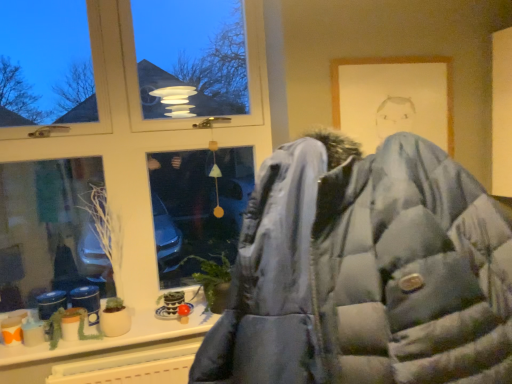
This screenshot has width=512, height=384. Describe the element at coordinates (115, 144) in the screenshot. I see `matte white window at center` at that location.

Describe the element at coordinates (63, 322) in the screenshot. The width and height of the screenshot is (512, 384). I see `green matte plant at lower left, which appears as the 1th plant when ordered from the bottom` at that location.

Locate an element on the screen. green matte plant at lower left, which appears as the 1th plant when ordered from the bottom is located at coordinates (63, 322).

The width and height of the screenshot is (512, 384). I want to click on matte white window at center, so click(115, 144).

Which is more to the right, yellow plastic radiator at lower center or green matte plant at lower left, which appears as the 1th plant when ordered from the bottom?

Positioned to the right is yellow plastic radiator at lower center.

Is yellow plastic radiator at lower center aimed at green matte plant at lower left, which appears as the 1th plant when ordered from the bottom?

No, yellow plastic radiator at lower center is not oriented towards green matte plant at lower left, which appears as the 1th plant when ordered from the bottom.

Looking at their sizes, would you say yellow plastic radiator at lower center is wider or thinner than green matte plant at lower left, which appears as the 1th plant when ordered from the bottom?

In the image, yellow plastic radiator at lower center appears to be more narrow than green matte plant at lower left, which appears as the 1th plant when ordered from the bottom.

Are yellow plastic radiator at lower center and green matte plant at lower left, which is the 2th plant from top to bottom, making contact?

yellow plastic radiator at lower center and green matte plant at lower left, which is the 2th plant from top to bottom, are not in contact.

From a real-world perspective, is yellow plastic radiator at lower center located higher than matte white window at center?

No.

How many degrees apart are the facing directions of yellow plastic radiator at lower center and matte white window at center?

The facing directions of yellow plastic radiator at lower center and matte white window at center are 0.386 degrees apart.

Measure the distance from yellow plastic radiator at lower center to matte white window at center.

yellow plastic radiator at lower center and matte white window at center are 29.05 inches apart.

Consider the image. Considering the relative positions of yellow plastic radiator at lower center and matte white window at center in the image provided, is yellow plastic radiator at lower center to the left of matte white window at center from the viewer's perspective?

No.

The height and width of the screenshot is (384, 512). In order to click on radiator on the right of white matte plant at lower left, the 2th plant ordered from the bottom in this screenshot , I will do `click(134, 373)`.

Can we say yellow plastic radiator at lower center lies outside white matte plant at lower left, the 2th plant ordered from the bottom?

That's correct, yellow plastic radiator at lower center is outside of white matte plant at lower left, the 2th plant ordered from the bottom.

Is point (166, 372) more distant than point (113, 249)?

No, it is in front of (113, 249).

Is yellow plastic radiator at lower center directly adjacent to white matte plant at lower left, the 1th plant positioned from the top?

There is a gap between yellow plastic radiator at lower center and white matte plant at lower left, the 1th plant positioned from the top.

Is matte white window at center thinner than green matte plant at lower left, which is the 2th plant from top to bottom?

Indeed, matte white window at center has a lesser width compared to green matte plant at lower left, which is the 2th plant from top to bottom.

Considering the relative sizes of matte white window at center and green matte plant at lower left, which is the 2th plant from top to bottom, in the image provided, is matte white window at center bigger than green matte plant at lower left, which is the 2th plant from top to bottom,?

Correct, matte white window at center is larger in size than green matte plant at lower left, which is the 2th plant from top to bottom.

The width and height of the screenshot is (512, 384). I want to click on window behind the green matte plant at lower left, which appears as the 1th plant when ordered from the bottom, so click(115, 144).

Is matte white window at center not inside yellow plastic radiator at lower center?

Absolutely, matte white window at center is external to yellow plastic radiator at lower center.

Does matte white window at center come behind yellow plastic radiator at lower center?

Yes, matte white window at center is behind yellow plastic radiator at lower center.

Is the surface of matte white window at center in direct contact with yellow plastic radiator at lower center?

There is a gap between matte white window at center and yellow plastic radiator at lower center.

Image resolution: width=512 pixels, height=384 pixels. In order to click on radiator in front of the matte white window at center in this screenshot , I will do `click(134, 373)`.

Does green matte plant at lower left, which is the 2th plant from top to bottom, have a lesser height compared to matte white window at center?

Correct, green matte plant at lower left, which is the 2th plant from top to bottom, is not as tall as matte white window at center.

Is green matte plant at lower left, which appears as the 1th plant when ordered from the bottom, bigger than matte white window at center?

Actually, green matte plant at lower left, which appears as the 1th plant when ordered from the bottom, might be smaller than matte white window at center.

Consider the image. Is green matte plant at lower left, which appears as the 1th plant when ordered from the bottom, far from matte white window at center?

green matte plant at lower left, which appears as the 1th plant when ordered from the bottom, is actually quite close to matte white window at center.

Considering the points (57, 343) and (111, 2), which point is in front, point (57, 343) or point (111, 2)?

The point (57, 343) is in front.

Which of these two, green matte plant at lower left, which appears as the 1th plant when ordered from the bottom, or yellow plastic radiator at lower center, is wider?

With larger width is green matte plant at lower left, which appears as the 1th plant when ordered from the bottom.

Consider the image. Which is nearer, [68,314] or [156,361]?

Point [156,361]

Who is bigger, green matte plant at lower left, which appears as the 1th plant when ordered from the bottom, or yellow plastic radiator at lower center?

Bigger between the two is yellow plastic radiator at lower center.

This screenshot has width=512, height=384. There is a yellow plastic radiator at lower center. In order to click on the 1st plant above it (from a real-world perspective) in this screenshot , I will do `click(63, 322)`.

Image resolution: width=512 pixels, height=384 pixels. I want to click on window lying behind the yellow plastic radiator at lower center, so click(115, 144).

From the image, which object appears to be nearer to white matte plant at lower left, the 2th plant ordered from the bottom, matte white window at center or green matte plant at lower left, which is the 2th plant from top to bottom?

The object closer to white matte plant at lower left, the 2th plant ordered from the bottom, is green matte plant at lower left, which is the 2th plant from top to bottom.

When comparing their distances from yellow plastic radiator at lower center, does green matte plant at lower left, which is the 2th plant from top to bottom, or white matte plant at lower left, the 1th plant positioned from the top, seem closer?

green matte plant at lower left, which is the 2th plant from top to bottom, is closer to yellow plastic radiator at lower center.

Based on their spatial positions, is matte white window at center or yellow plastic radiator at lower center further from green matte plant at lower left, which appears as the 1th plant when ordered from the bottom?

Based on the image, matte white window at center appears to be further to green matte plant at lower left, which appears as the 1th plant when ordered from the bottom.

When comparing their distances from green matte plant at lower left, which appears as the 1th plant when ordered from the bottom, does white matte plant at lower left, the 1th plant positioned from the top, or yellow plastic radiator at lower center seem further?

white matte plant at lower left, the 1th plant positioned from the top, is further to green matte plant at lower left, which appears as the 1th plant when ordered from the bottom.

Looking at this image, from the image, which object appears to be nearer to matte white window at center, yellow plastic radiator at lower center or green matte plant at lower left, which appears as the 1th plant when ordered from the bottom?

green matte plant at lower left, which appears as the 1th plant when ordered from the bottom, lies closer to matte white window at center than the other object.

Estimate the real-world distances between objects in this image. Which object is closer to matte white window at center, white matte plant at lower left, the 2th plant ordered from the bottom, or green matte plant at lower left, which appears as the 1th plant when ordered from the bottom?

white matte plant at lower left, the 2th plant ordered from the bottom, is closer to matte white window at center.

Considering their positions, is green matte plant at lower left, which is the 2th plant from top to bottom, positioned closer to matte white window at center than white matte plant at lower left, the 2th plant ordered from the bottom?

white matte plant at lower left, the 2th plant ordered from the bottom.

In the scene shown: Considering their positions, is white matte plant at lower left, the 1th plant positioned from the top, positioned closer to matte white window at center than yellow plastic radiator at lower center?

Among the two, white matte plant at lower left, the 1th plant positioned from the top, is located nearer to matte white window at center.

I want to click on plant that lies between white matte plant at lower left, the 2th plant ordered from the bottom, and yellow plastic radiator at lower center from top to bottom, so click(63, 322).

At what (x,y) coordinates should I click in order to perform the action: click on plant between matte white window at center and green matte plant at lower left, which is the 2th plant from top to bottom, in the up-down direction. Please return your answer as a coordinate pair (x, y). Looking at the image, I should click on (105, 230).